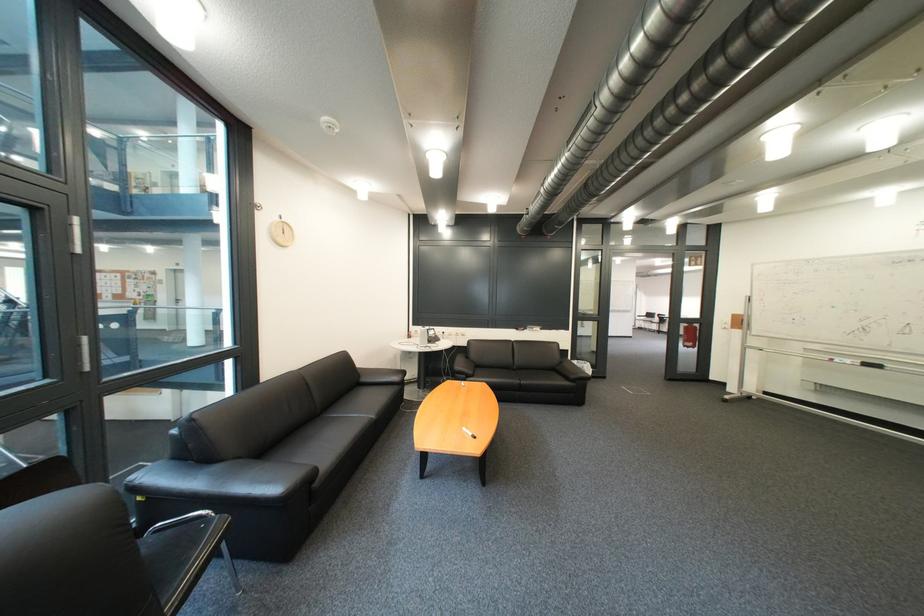
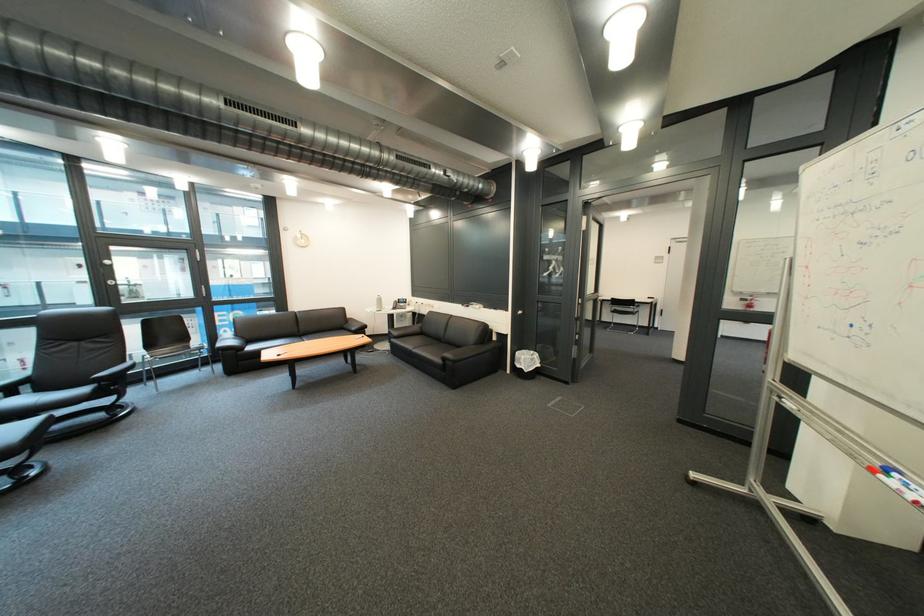
In the second image, find the point that corresponds to (845,361) in the first image.

(901, 472)